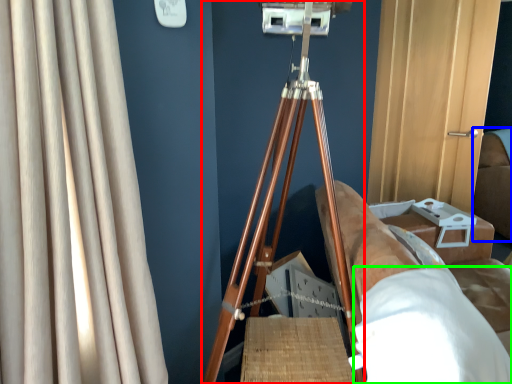
Question: Which object is the closest to the tripod (highlighted by a red box)? Choose among these: couch (highlighted by a blue box) or sheet (highlighted by a green box).

Choices:
 (A) couch
 (B) sheet

Answer: (B)